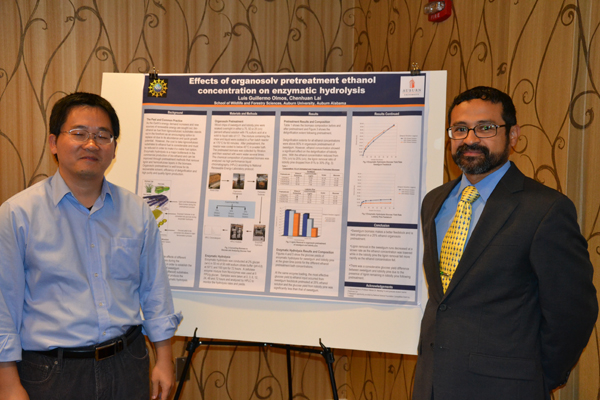
Find the location of a particular element. The width and height of the screenshot is (600, 400). fire alarm is located at coordinates (440, 14).